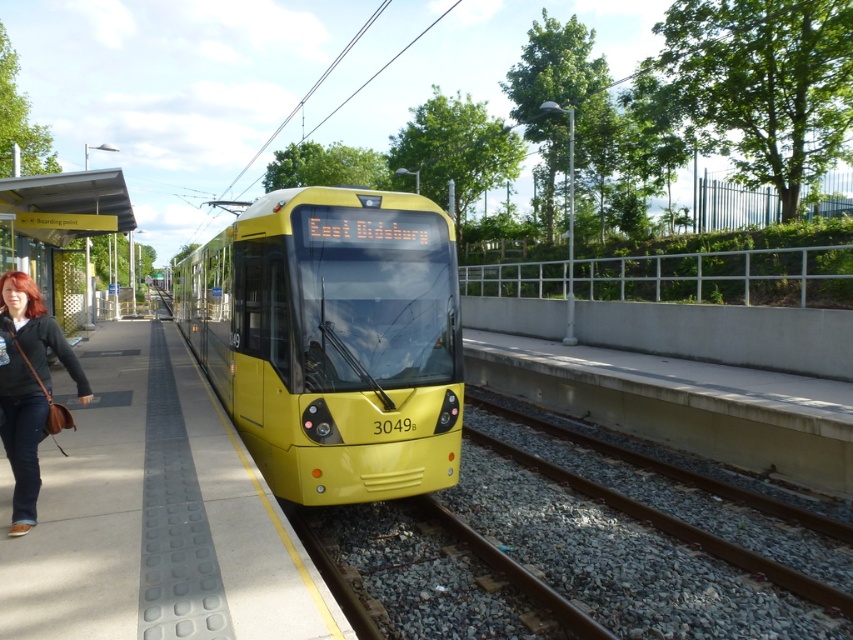
Does yellow matte train at center have a smaller size compared to yellow plastic bus stop at left?

Incorrect, yellow matte train at center is not smaller in size than yellow plastic bus stop at left.

Which is more to the right, yellow matte train at center or yellow plastic bus stop at left?

From the viewer's perspective, yellow matte train at center appears more on the right side.

Who is more distant from viewer, (281, 364) or (9, 266)?

The point (9, 266) is behind.

Where is `yellow matte train at center`? yellow matte train at center is located at coordinates (332, 340).

Is point (263, 250) positioned before point (54, 326)?

No, (263, 250) is behind (54, 326).

Can you confirm if yellow matte train at center is taller than matte brown leather bag at lower left?

Yes.

The height and width of the screenshot is (640, 853). What do you see at coordinates (332, 340) in the screenshot? I see `yellow matte train at center` at bounding box center [332, 340].

What are the coordinates of `yellow matte train at center` in the screenshot? It's located at (332, 340).

Which is in front, point (555, 563) or point (566, 620)?

Positioned in front is point (566, 620).

What are the coordinates of `yellow metal train track at center` in the screenshot? It's located at (646, 541).

Locate an element on the screen. yellow metal train track at center is located at coordinates (646, 541).